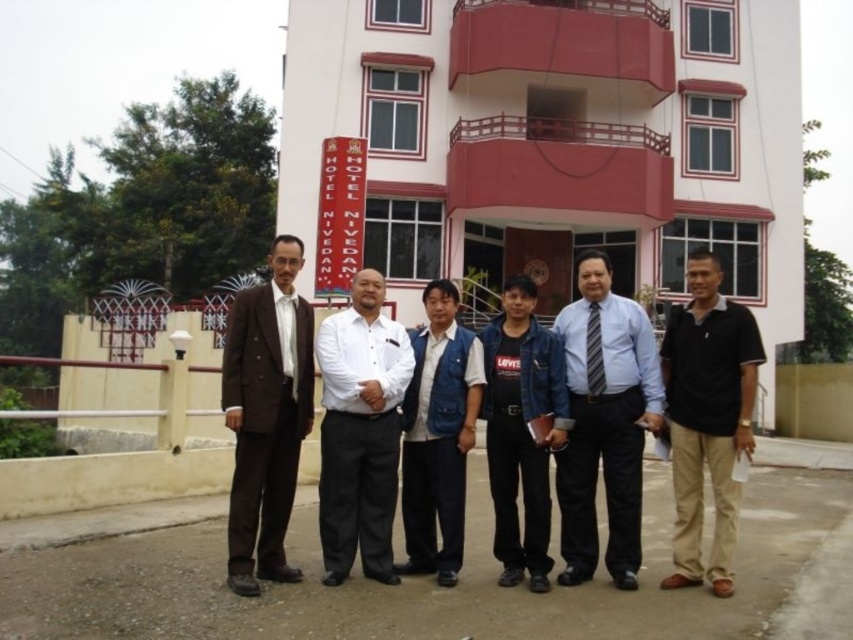
Does white painted building at center appear on the left side of white shirt at center?

Incorrect, white painted building at center is not on the left side of white shirt at center.

Who is more forward, (599,28) or (393,392)?

Point (393,392)

The image size is (853, 640). Find the location of `white painted building at center`. white painted building at center is located at coordinates (556, 140).

I want to click on white painted building at center, so click(x=556, y=140).

Is white shirt at center closer to camera compared to denim jacket at center?

No, white shirt at center is further to the viewer.

Is white shirt at center smaller than denim jacket at center?

Yes.

Which is behind, point (375, 378) or point (502, 348)?

Point (502, 348)

At what (x,y) coordinates should I click in order to perform the action: click on white shirt at center. Please return your answer as a coordinate pair (x, y). Looking at the image, I should click on (360, 432).

Between brown fabric suit at left and white shirt at center, which one appears on the right side from the viewer's perspective?

white shirt at center

Between brown fabric suit at left and white shirt at center, which one is positioned lower?

white shirt at center

What do you see at coordinates (265, 416) in the screenshot? I see `brown fabric suit at left` at bounding box center [265, 416].

At what (x,y) coordinates should I click in order to perform the action: click on brown fabric suit at left. Please return your answer as a coordinate pair (x, y). Looking at the image, I should click on (265, 416).